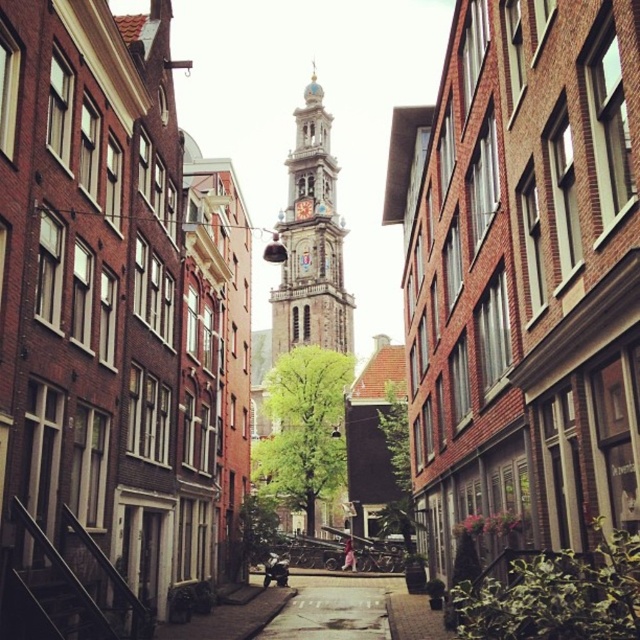
Question: Is smooth stone clock tower at center in front of smooth concrete pavement at center?

Choices:
 (A) yes
 (B) no

Answer: (B)

Question: Can you confirm if smooth stone clock tower at center is wider than smooth concrete pavement at center?

Choices:
 (A) yes
 (B) no

Answer: (A)

Question: Which object is closer to the camera taking this photo?

Choices:
 (A) smooth concrete pavement at center
 (B) smooth stone clock tower at center

Answer: (A)

Question: Is smooth stone clock tower at center smaller than smooth concrete pavement at center?

Choices:
 (A) yes
 (B) no

Answer: (B)

Question: Which object is closer to the camera taking this photo?

Choices:
 (A) smooth stone clock tower at center
 (B) smooth concrete pavement at center

Answer: (B)